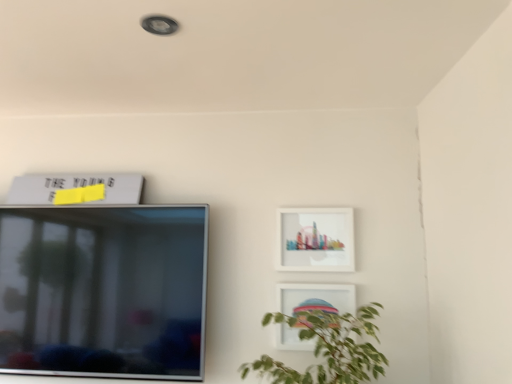
Question: Is matte white picture frame at upper right, which is the first picture frame in right-to-left order, wider than white glossy picture frame at lower right, which appears as the second picture frame when viewed from the right?

Choices:
 (A) no
 (B) yes

Answer: (A)

Question: Is matte white picture frame at upper right, which is the first picture frame in right-to-left order, in contact with white glossy picture frame at lower right, which appears as the third picture frame when viewed from the top?

Choices:
 (A) yes
 (B) no

Answer: (B)

Question: Is white glossy picture frame at lower right, which is the 2th picture frame in left-to-right order, surrounded by matte white picture frame at upper right, acting as the second picture frame starting from the bottom?

Choices:
 (A) no
 (B) yes

Answer: (A)

Question: Could you tell me if matte white picture frame at upper right, which is the first picture frame in right-to-left order, is turned towards white glossy picture frame at lower right, which is the 2th picture frame in left-to-right order?

Choices:
 (A) yes
 (B) no

Answer: (B)

Question: Is matte white picture frame at upper right, acting as the 3th picture frame starting from the left, not within white glossy picture frame at lower right, which appears as the second picture frame when viewed from the right?

Choices:
 (A) no
 (B) yes

Answer: (B)

Question: In the image, is white matte picture frame at upper left, the 1th picture frame in the top-to-bottom sequence, on the left side or the right side of white glossy picture frame at lower right, which is the 2th picture frame in left-to-right order?

Choices:
 (A) right
 (B) left

Answer: (B)

Question: Is white matte picture frame at upper left, marked as the 1th picture frame in a left-to-right arrangement, wider or thinner than white glossy picture frame at lower right, which appears as the third picture frame when viewed from the top?

Choices:
 (A) wide
 (B) thin

Answer: (A)

Question: Is white matte picture frame at upper left, marked as the 1th picture frame in a left-to-right arrangement, inside the boundaries of white glossy picture frame at lower right, which is the 2th picture frame in left-to-right order, or outside?

Choices:
 (A) inside
 (B) outside

Answer: (B)

Question: Does point (119, 203) appear closer or farther from the camera than point (343, 296)?

Choices:
 (A) farther
 (B) closer

Answer: (A)

Question: Is white glossy picture frame at lower right, which appears as the third picture frame when viewed from the top, wider or thinner than matte white picture frame at upper right, which is the first picture frame in right-to-left order?

Choices:
 (A) thin
 (B) wide

Answer: (B)

Question: In the image, is white glossy picture frame at lower right, which is the 2th picture frame in left-to-right order, positioned in front of or behind matte white picture frame at upper right, which is the first picture frame in right-to-left order?

Choices:
 (A) behind
 (B) front

Answer: (B)

Question: Would you say white glossy picture frame at lower right, which appears as the second picture frame when viewed from the right, is inside or outside matte white picture frame at upper right, acting as the 3th picture frame starting from the left?

Choices:
 (A) inside
 (B) outside

Answer: (B)

Question: From the image's perspective, relative to matte white picture frame at upper right, acting as the second picture frame starting from the bottom, is white glossy picture frame at lower right, which appears as the third picture frame when viewed from the top, above or below?

Choices:
 (A) below
 (B) above

Answer: (A)

Question: In the image, is matte white picture frame at upper right, arranged as the 2th picture frame when viewed from the top, positioned in front of or behind white matte picture frame at upper left, the 1th picture frame in the top-to-bottom sequence?

Choices:
 (A) behind
 (B) front

Answer: (B)

Question: In the image, is matte white picture frame at upper right, which is the first picture frame in right-to-left order, on the left side or the right side of white matte picture frame at upper left, marked as the 1th picture frame in a left-to-right arrangement?

Choices:
 (A) right
 (B) left

Answer: (A)